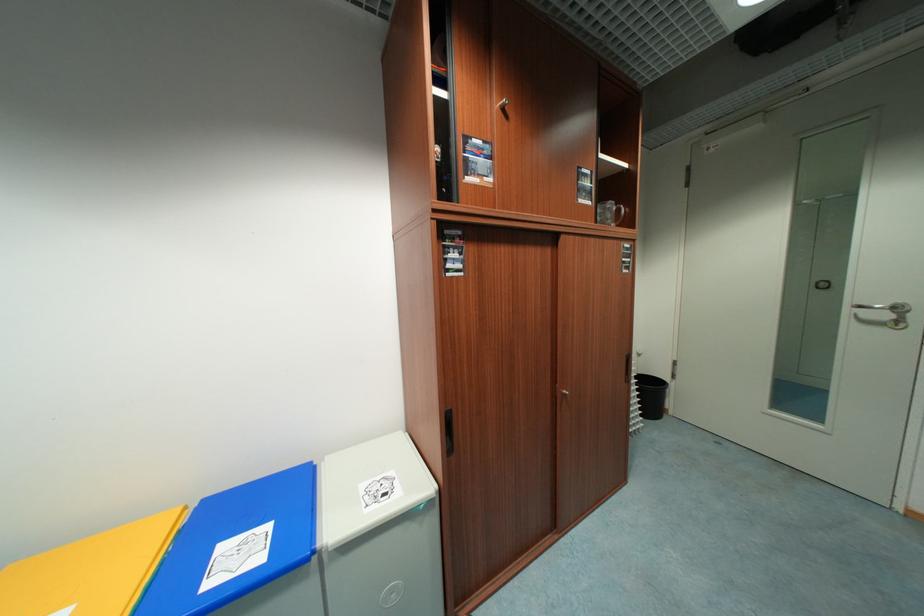
At what (x,y) coordinates should I click in order to perform the action: click on black recessed handle. Please return your answer as a coordinate pair (x, y). Looking at the image, I should click on (448, 431).